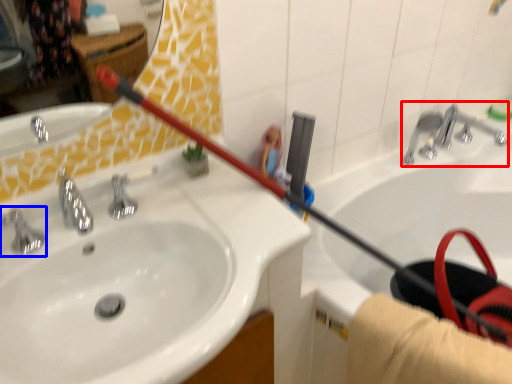
Question: Which object appears closest to the camera in this image, plumbing fixture (highlighted by a red box) or tap (highlighted by a blue box)?

Choices:
 (A) plumbing fixture
 (B) tap

Answer: (B)